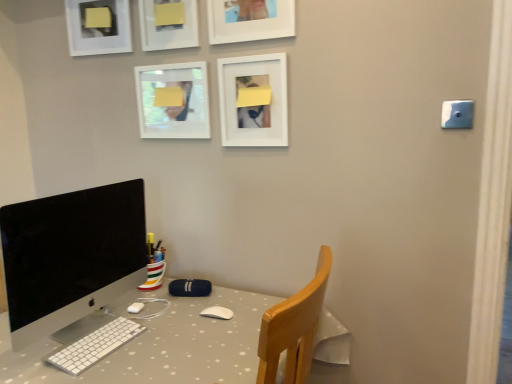
The width and height of the screenshot is (512, 384). What do you see at coordinates (457, 114) in the screenshot? I see `blue plastic light switch at upper right` at bounding box center [457, 114].

The width and height of the screenshot is (512, 384). I want to click on silver metallic monitor at left, so click(x=71, y=256).

What is the approximate width of white glossy picture frame at upper center, which appears as the 2th picture frame when viewed from the left?

white glossy picture frame at upper center, which appears as the 2th picture frame when viewed from the left, is 1.92 inches in width.

What do you see at coordinates (173, 101) in the screenshot?
I see `white glossy picture frame at upper center, which appears as the 2th picture frame when viewed from the left` at bounding box center [173, 101].

Describe the element at coordinates (162, 345) in the screenshot. I see `white polka dot desk at center` at that location.

At what (x,y) coordinates should I click in order to perform the action: click on white plastic keyboard at lower left. Please return your answer as a coordinate pair (x, y). This screenshot has height=384, width=512. Looking at the image, I should click on (94, 346).

This screenshot has width=512, height=384. In order to click on matte white picture frame at upper center, which ranks as the third picture frame in right-to-left order in this screenshot , I will do `click(168, 24)`.

Consider the image. What's the angular difference between white plastic keyboard at lower left and white glossy picture frame at upper center, arranged as the fourth picture frame when viewed from the right,'s facing directions?

There is a 90-degree angle between the facing directions of white plastic keyboard at lower left and white glossy picture frame at upper center, arranged as the fourth picture frame when viewed from the right.

From a real-world perspective, which is physically below, white plastic keyboard at lower left or white glossy picture frame at upper center, arranged as the fourth picture frame when viewed from the right?

From a 3D spatial view, white plastic keyboard at lower left is below.

Which is more distant, (90, 362) or (147, 125)?

Positioned behind is point (147, 125).

Considering the sizes of objects white matte picture frame at upper center, which ranks as the 1th picture frame in right-to-left order, and white plastic keyboard at lower left in the image provided, who is thinner, white matte picture frame at upper center, which ranks as the 1th picture frame in right-to-left order, or white plastic keyboard at lower left?

With smaller width is white matte picture frame at upper center, which ranks as the 1th picture frame in right-to-left order.

Is point (274, 144) closer to viewer compared to point (83, 356)?

No.

From the image's perspective, between white matte picture frame at upper center, which ranks as the 1th picture frame in right-to-left order, and white plastic keyboard at lower left, who is located below?

white plastic keyboard at lower left appears lower in the image.

How many degrees apart are the facing directions of white matte picture frame at upper center, which ranks as the 1th picture frame in right-to-left order, and white plastic keyboard at lower left?

90 degrees.

Who is bigger, blue plastic light switch at upper right or matte white picture frame at upper left, which is the 5th picture frame in right-to-left order?

Bigger between the two is matte white picture frame at upper left, which is the 5th picture frame in right-to-left order.

From the image's perspective, which one is positioned lower, blue plastic light switch at upper right or matte white picture frame at upper left, which is the 5th picture frame in right-to-left order?

blue plastic light switch at upper right appears lower in the image.

Is blue plastic light switch at upper right with matte white picture frame at upper left, which is the 5th picture frame in right-to-left order?

blue plastic light switch at upper right and matte white picture frame at upper left, which is the 5th picture frame in right-to-left order, are clearly separated.

Consider the image. Is silver metallic monitor at left positioned with its back to white polka dot desk at center?

No, white polka dot desk at center is not at the back of silver metallic monitor at left.

Which point is more forward, (93, 211) or (18, 364)?

Point (18, 364)

Would you consider silver metallic monitor at left to be distant from white polka dot desk at center?

No, silver metallic monitor at left is in close proximity to white polka dot desk at center.

Consider the image. In terms of height, does white plastic keyboard at lower left look taller or shorter compared to silver metallic monitor at left?

Clearly, white plastic keyboard at lower left is shorter compared to silver metallic monitor at left.

Is white plastic keyboard at lower left looking in the opposite direction of silver metallic monitor at left?

Correct, white plastic keyboard at lower left is looking away from silver metallic monitor at left.

Who is bigger, white plastic keyboard at lower left or silver metallic monitor at left?

With larger size is silver metallic monitor at left.

Can you confirm if white matte picture frame at upper center, which is the fourth picture frame in left-to-right order, is wider than matte white picture frame at upper center, which ranks as the 3th picture frame in left-to-right order?

Indeed, white matte picture frame at upper center, which is the fourth picture frame in left-to-right order, has a greater width compared to matte white picture frame at upper center, which ranks as the 3th picture frame in left-to-right order.

Considering the sizes of objects white matte picture frame at upper center, the 2th picture frame when ordered from right to left, and matte white picture frame at upper center, which ranks as the third picture frame in right-to-left order, in the image provided, who is smaller, white matte picture frame at upper center, the 2th picture frame when ordered from right to left, or matte white picture frame at upper center, which ranks as the third picture frame in right-to-left order,?

Smaller between the two is matte white picture frame at upper center, which ranks as the third picture frame in right-to-left order.

Is white matte picture frame at upper center, the 2th picture frame when ordered from right to left, inside the boundaries of matte white picture frame at upper center, which ranks as the third picture frame in right-to-left order, or outside?

The correct answer is: outside.

Which object is positioned more to the left, white matte picture frame at upper center, the 2th picture frame when ordered from right to left, or matte white picture frame at upper center, which ranks as the third picture frame in right-to-left order?

Positioned to the left is matte white picture frame at upper center, which ranks as the third picture frame in right-to-left order.

From their relative heights in the image, would you say white matte picture frame at upper center, the 2th picture frame when ordered from right to left, is taller or shorter than white matte picture frame at upper center, which ranks as the 1th picture frame in right-to-left order?

Considering their sizes, white matte picture frame at upper center, the 2th picture frame when ordered from right to left, has less height than white matte picture frame at upper center, which ranks as the 1th picture frame in right-to-left order.

Between white matte picture frame at upper center, the 2th picture frame when ordered from right to left, and white matte picture frame at upper center, which ranks as the 1th picture frame in right-to-left order, which one is positioned behind?

white matte picture frame at upper center, which ranks as the 1th picture frame in right-to-left order, is further away from the camera.

Could you tell me if white matte picture frame at upper center, the 2th picture frame when ordered from right to left, is turned towards white matte picture frame at upper center, which ranks as the 1th picture frame in right-to-left order?

No, white matte picture frame at upper center, the 2th picture frame when ordered from right to left, is not oriented towards white matte picture frame at upper center, which ranks as the 1th picture frame in right-to-left order.

Are white matte picture frame at upper center, which is the fourth picture frame in left-to-right order, and white matte picture frame at upper center, the fifth picture frame in the left-to-right sequence, making contact?

They are not placed beside each other.

Which picture frame is the 4th one when counting from the back of the white plastic keyboard at lower left? Please provide its 2D coordinates.

[(173, 101)]

In order to click on computer keyboard below the white matte picture frame at upper center, the fifth picture frame in the left-to-right sequence (from the image's perspective) in this screenshot , I will do `click(94, 346)`.

Looking at the image, which one is located further to white matte picture frame at upper center, which is the fourth picture frame in left-to-right order, white matte picture frame at upper center, the fifth picture frame in the left-to-right sequence, or silver metallic monitor at left?

silver metallic monitor at left lies further to white matte picture frame at upper center, which is the fourth picture frame in left-to-right order, than the other object.

Looking at the image, which one is located further to white matte picture frame at upper center, the fifth picture frame in the left-to-right sequence, white plastic keyboard at lower left or white glossy picture frame at upper center, which appears as the 2th picture frame when viewed from the left?

Based on the image, white plastic keyboard at lower left appears to be further to white matte picture frame at upper center, the fifth picture frame in the left-to-right sequence.

From the picture: Considering their positions, is silver metallic monitor at left positioned closer to white matte picture frame at upper center, the 2th picture frame when ordered from right to left, than white polka dot desk at center?

silver metallic monitor at left lies closer to white matte picture frame at upper center, the 2th picture frame when ordered from right to left, than the other object.

Which object lies further to the anchor point silver metallic monitor at left, white plastic keyboard at lower left or white glossy picture frame at upper center, which appears as the 2th picture frame when viewed from the left?

white glossy picture frame at upper center, which appears as the 2th picture frame when viewed from the left, lies further to silver metallic monitor at left than the other object.

Based on the photo, estimate the real-world distances between objects in this image. Which object is further from matte white picture frame at upper center, which ranks as the 3th picture frame in left-to-right order, white glossy picture frame at upper center, arranged as the fourth picture frame when viewed from the right, or blue plastic light switch at upper right?

blue plastic light switch at upper right.

From the image, which object appears to be farther from silver metallic monitor at left, white glossy picture frame at upper center, arranged as the fourth picture frame when viewed from the right, or white plastic keyboard at lower left?

white glossy picture frame at upper center, arranged as the fourth picture frame when viewed from the right, lies further to silver metallic monitor at left than the other object.

Which object lies further to the anchor point white polka dot desk at center, white plastic keyboard at lower left or matte white picture frame at upper center, which ranks as the 3th picture frame in left-to-right order?

Among the two, matte white picture frame at upper center, which ranks as the 3th picture frame in left-to-right order, is located further to white polka dot desk at center.

Which object lies nearer to the anchor point silver metallic monitor at left, blue plastic light switch at upper right or matte white picture frame at upper left, which is the 5th picture frame in right-to-left order?

matte white picture frame at upper left, which is the 5th picture frame in right-to-left order, lies closer to silver metallic monitor at left than the other object.

The height and width of the screenshot is (384, 512). Identify the location of computer keyboard between matte white picture frame at upper center, which ranks as the third picture frame in right-to-left order, and white polka dot desk at center from top to bottom. (94, 346).

Identify the location of light switch between white matte picture frame at upper center, the 2th picture frame when ordered from right to left, and white polka dot desk at center vertically. (457, 114).

Locate an element on the screen. The height and width of the screenshot is (384, 512). computer keyboard between matte white picture frame at upper left, which is the 5th picture frame in right-to-left order, and white polka dot desk at center, in the vertical direction is located at coordinates (94, 346).

At what (x,y) coordinates should I click in order to perform the action: click on computer keyboard between white matte picture frame at upper center, which ranks as the 1th picture frame in right-to-left order, and white polka dot desk at center in the up-down direction. Please return your answer as a coordinate pair (x, y). This screenshot has height=384, width=512. Looking at the image, I should click on (94, 346).